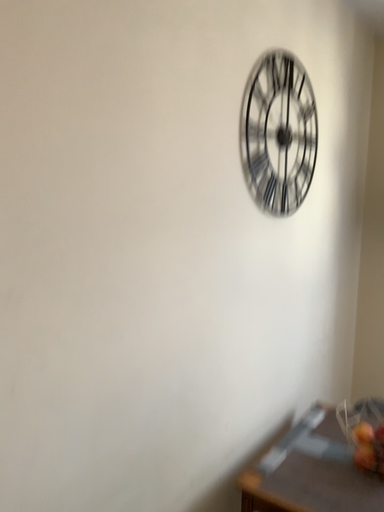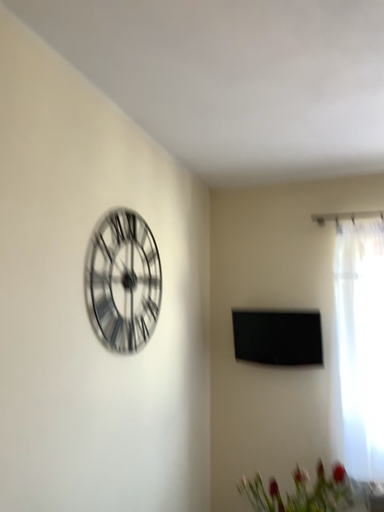
Question: Which way did the camera rotate in the video?

Choices:
 (A) rotated downward
 (B) rotated upward

Answer: (B)